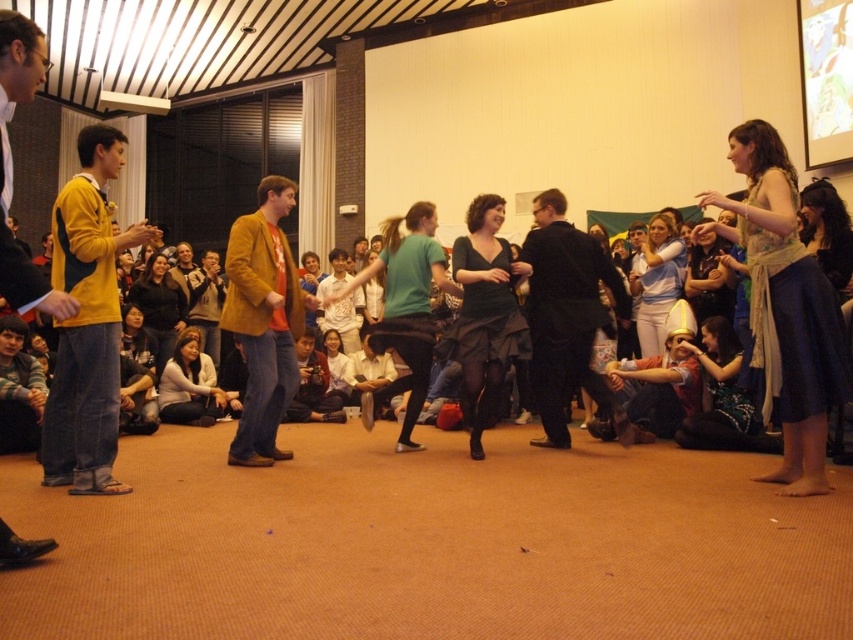
Is point (305, 298) positioned after point (335, 305)?

No, it is in front of (335, 305).

Consider the image. Who is lower down, mustard yellow jacket at center or white cotton shirt at center?

mustard yellow jacket at center is lower down.

Does point (247, 220) come behind point (346, 268)?

No, (247, 220) is in front of (346, 268).

Identify the location of mustard yellow jacket at center. The width and height of the screenshot is (853, 640). (264, 321).

Between dark green dress at center and white shirt at center, which one appears on the right side from the viewer's perspective?

dark green dress at center

Between dark green dress at center and white shirt at center, which one is positioned lower?

white shirt at center is lower down.

Which is behind, point (474, 388) or point (338, 376)?

The point (338, 376) is behind.

What are the coordinates of `dark green dress at center` in the screenshot? It's located at (485, 312).

Can you confirm if yellow fleece jacket at left is positioned to the right of dark brown leather jacket at lower left?

Correct, you'll find yellow fleece jacket at left to the right of dark brown leather jacket at lower left.

Is yellow fleece jacket at left behind dark brown leather jacket at lower left?

No.

You are a GUI agent. You are given a task and a screenshot of the screen. Output one action in this format:
    pyautogui.click(x=<x>, y=<y>)
    Task: Click on the yellow fleece jacket at left
    The width and height of the screenshot is (853, 640).
    Given the screenshot: What is the action you would take?
    pyautogui.click(x=86, y=321)